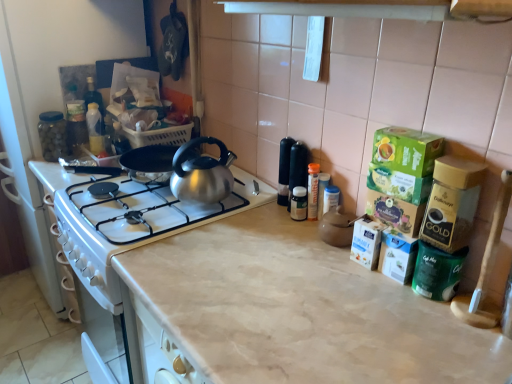
The width and height of the screenshot is (512, 384). I want to click on vacant area to the left of green matte coffee container at right, which appears as the second appliance when viewed from the back, so click(361, 297).